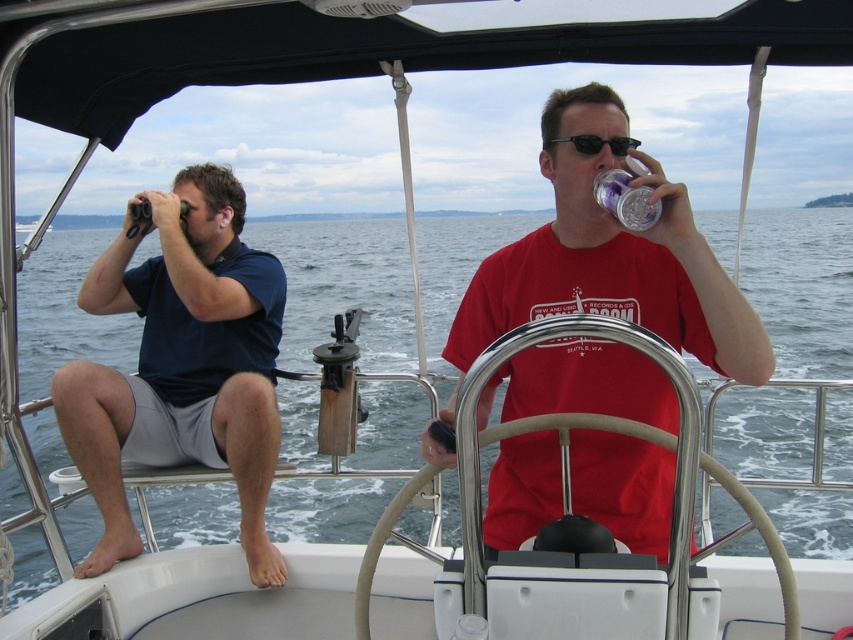
Question: Does clear plastic cup at upper right appear on the left side of black plastic sunglasses at upper center?

Choices:
 (A) yes
 (B) no

Answer: (A)

Question: Which point is closer to the camera?

Choices:
 (A) clear plastic cup at upper right
 (B) black plastic sunglasses at upper center
 (C) dark blue shirt at left

Answer: (B)

Question: Can you confirm if matte red t-shirt at center is wider than black plastic sunglasses at upper center?

Choices:
 (A) yes
 (B) no

Answer: (A)

Question: Is matte red t-shirt at center thinner than black plastic sunglasses at upper center?

Choices:
 (A) no
 (B) yes

Answer: (A)

Question: Based on their relative distances, which object is farther from the dark blue shirt at left?

Choices:
 (A) clear plastic cup at upper right
 (B) matte red t-shirt at center

Answer: (A)

Question: Considering the real-world distances, which object is closest to the black plastic sunglasses at upper center?

Choices:
 (A) dark blue shirt at left
 (B) clear plastic cup at upper right
 (C) matte red t-shirt at center

Answer: (B)